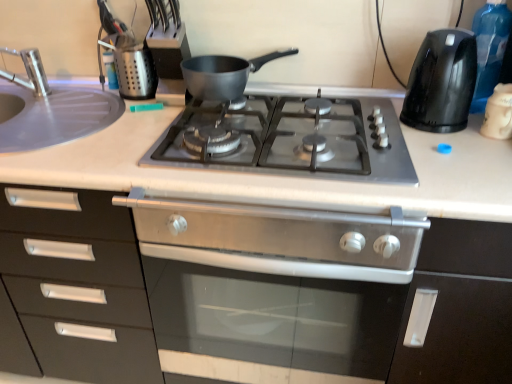
Question: Considering the positions of satin black oven at center and black plastic kettle at right, which ranks as the second kitchen appliance in left-to-right order, in the image, is satin black oven at center wider or thinner than black plastic kettle at right, which ranks as the second kitchen appliance in left-to-right order,?

Choices:
 (A) wide
 (B) thin

Answer: (A)

Question: Considering the relative positions of satin black oven at center and black plastic kettle at right, which ranks as the second kitchen appliance in left-to-right order, in the image provided, is satin black oven at center to the left or to the right of black plastic kettle at right, which ranks as the second kitchen appliance in left-to-right order,?

Choices:
 (A) right
 (B) left

Answer: (B)

Question: Estimate the real-world distances between objects in this image. Which object is farther from the silver metallic faucet at left?

Choices:
 (A) transparent plastic bottle at right
 (B) metallic silver utensil holder at upper left
 (C) black plastic kettle at right, which ranks as the second kitchen appliance in left-to-right order
 (D) matte black pot at center, the 3th kitchen appliance viewed from the right
 (E) stainless steel gas stove at center

Answer: (A)

Question: Considering the real-world distances, which object is farthest from the satin steel sink at left?

Choices:
 (A) white glossy coffee cup at upper right, the third kitchen appliance viewed from the left
 (B) matte black pot at center, the 3th kitchen appliance viewed from the right
 (C) satin black oven at center
 (D) transparent plastic bottle at right
 (E) silver metallic faucet at left

Answer: (A)